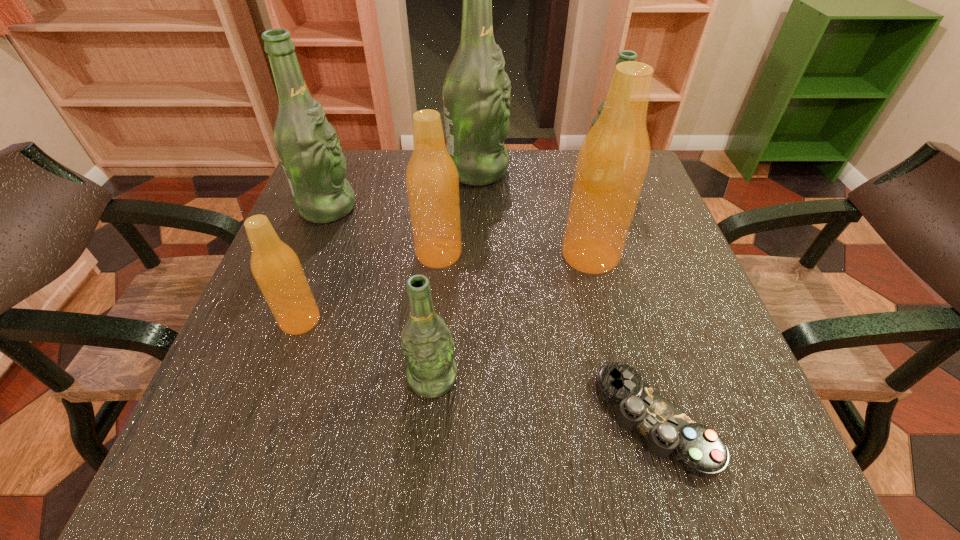
In order to click on blank space at the far left corner in this screenshot , I will do `click(352, 152)`.

At what (x,y) coordinates should I click in order to perform the action: click on free point at the near left corner. Please return your answer as a coordinate pair (x, y). Looking at the image, I should click on (210, 460).

This screenshot has width=960, height=540. Find the location of `empty space that is in between the shortest object and the rightmost green beer bottle`. empty space that is in between the shortest object and the rightmost green beer bottle is located at coordinates (628, 300).

The image size is (960, 540). What are the coordinates of `vacant area between the rightmost green beer bottle and the leftmost green beer bottle` in the screenshot? It's located at (464, 194).

I want to click on free space between the second biggest tan beer bottle and the third nearest object, so click(x=370, y=287).

The width and height of the screenshot is (960, 540). I want to click on free spot between the nearest tan beer bottle and the rightmost tan beer bottle, so click(445, 288).

This screenshot has width=960, height=540. I want to click on free space between the biggest tan beer bottle and the second biggest tan beer bottle, so click(x=515, y=254).

What are the coordinates of `empty location between the leftmost green beer bottle and the second nearest beer bottle` in the screenshot? It's located at (314, 264).

Identify the location of free area in between the second biggest tan beer bottle and the shortest object. The height and width of the screenshot is (540, 960). click(546, 337).

Locate an element on the screen. Image resolution: width=960 pixels, height=540 pixels. free space between the control and the nearest green beer bottle is located at coordinates (543, 399).